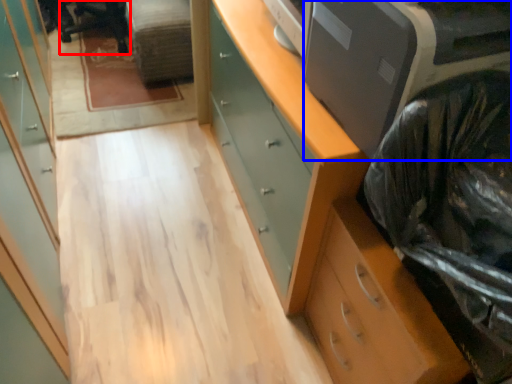
Question: Which object is further to the camera taking this photo, computer chair (highlighted by a red box) or printer (highlighted by a blue box)?

Choices:
 (A) computer chair
 (B) printer

Answer: (A)